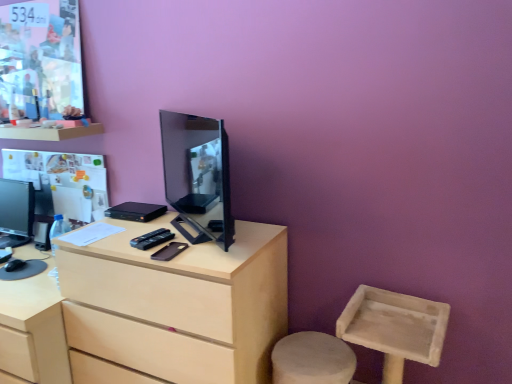
Identify the location of vacant region to the left of black matte mobile phone at center. The width and height of the screenshot is (512, 384). (128, 242).